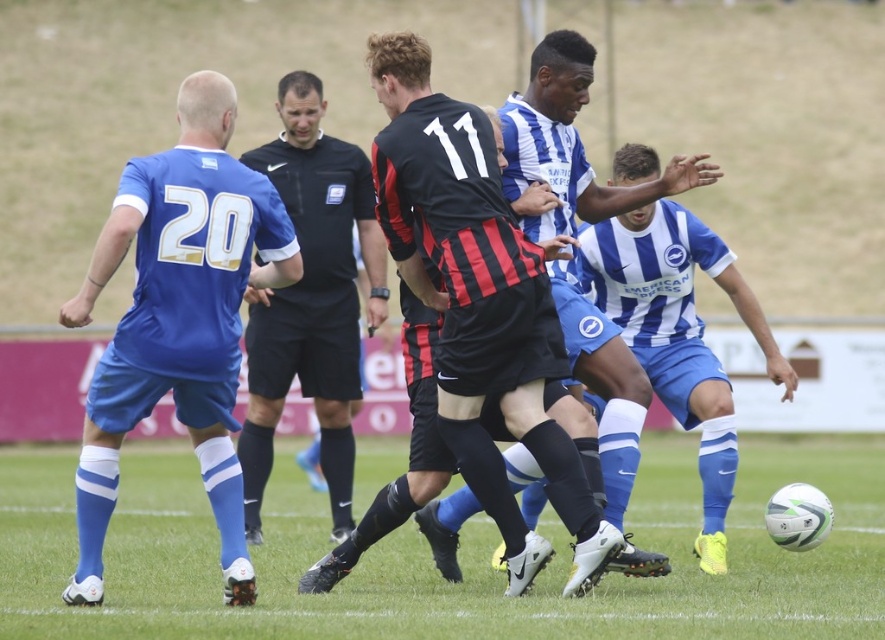
Does black/smooth shirt at center have a greater width compared to blue striped jersey at center?

Yes, black/smooth shirt at center is wider than blue striped jersey at center.

Who is taller, black/smooth shirt at center or blue striped jersey at center?

blue striped jersey at center is taller.

Find the location of a particular element. Image resolution: width=885 pixels, height=640 pixels. black/smooth shirt at center is located at coordinates (312, 298).

This screenshot has height=640, width=885. Describe the element at coordinates (178, 317) in the screenshot. I see `matte blue jersey at left` at that location.

Does matte blue jersey at left appear under black/smooth shirt at center?

Yes, matte blue jersey at left is below black/smooth shirt at center.

Where is `matte blue jersey at left`? matte blue jersey at left is located at coordinates (178, 317).

Find the location of `matte blue jersey at left`. matte blue jersey at left is located at coordinates (178, 317).

Can you confirm if white textured football at center is positioned to the right of black/smooth shirt at center?

Yes, white textured football at center is to the right of black/smooth shirt at center.

The width and height of the screenshot is (885, 640). In order to click on white textured football at center in this screenshot , I will do `click(460, 557)`.

I want to click on white textured football at center, so click(460, 557).